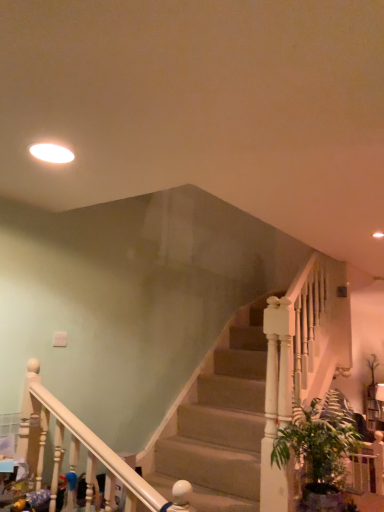
Question: Is green leafy plant at lower right at the left side of white glossy light fixture at upper left?

Choices:
 (A) no
 (B) yes

Answer: (A)

Question: Is white glossy light fixture at upper left at the back of green leafy plant at lower right?

Choices:
 (A) yes
 (B) no

Answer: (B)

Question: Can you confirm if green leafy plant at lower right is bigger than white glossy light fixture at upper left?

Choices:
 (A) no
 (B) yes

Answer: (B)

Question: Considering the relative sizes of green leafy plant at lower right and white glossy light fixture at upper left in the image provided, is green leafy plant at lower right taller than white glossy light fixture at upper left?

Choices:
 (A) yes
 (B) no

Answer: (A)

Question: Is green leafy plant at lower right next to white glossy light fixture at upper left?

Choices:
 (A) yes
 (B) no

Answer: (B)

Question: Is green leafy plant at lower right surrounding white glossy light fixture at upper left?

Choices:
 (A) yes
 (B) no

Answer: (B)

Question: Is white glossy light fixture at upper left outside green leafy plant at lower right?

Choices:
 (A) yes
 (B) no

Answer: (A)

Question: Considering the relative sizes of white glossy light fixture at upper left and green leafy plant at lower right in the image provided, is white glossy light fixture at upper left shorter than green leafy plant at lower right?

Choices:
 (A) yes
 (B) no

Answer: (A)

Question: Does white glossy light fixture at upper left lie behind green leafy plant at lower right?

Choices:
 (A) no
 (B) yes

Answer: (A)

Question: Can you confirm if white glossy light fixture at upper left is positioned to the left of green leafy plant at lower right?

Choices:
 (A) no
 (B) yes

Answer: (B)

Question: From the image's perspective, does white glossy light fixture at upper left appear lower than green leafy plant at lower right?

Choices:
 (A) no
 (B) yes

Answer: (A)

Question: Can you confirm if white glossy light fixture at upper left is wider than green leafy plant at lower right?

Choices:
 (A) no
 (B) yes

Answer: (A)

Question: Is point (49, 156) closer or farther from the camera than point (292, 409)?

Choices:
 (A) farther
 (B) closer

Answer: (B)